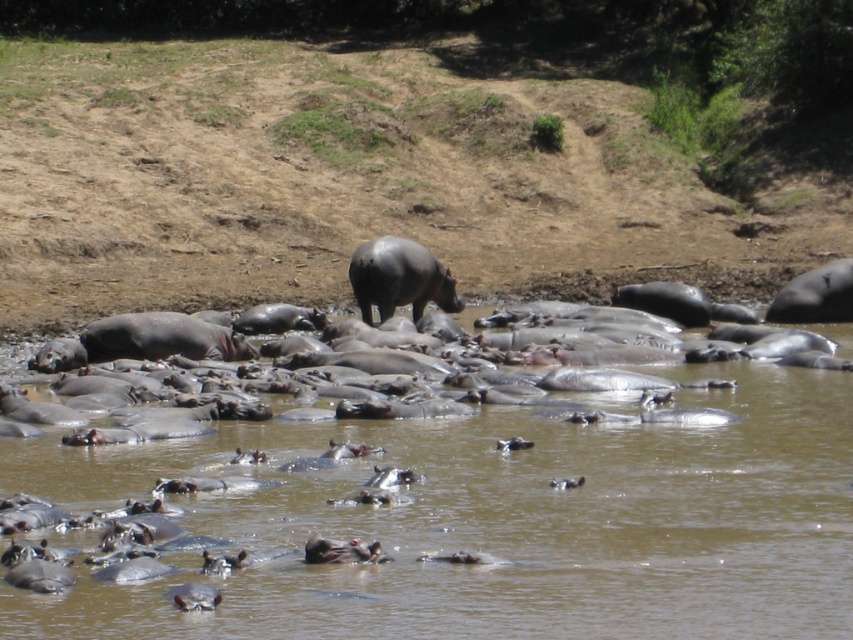
Is gray matte hippo at center to the right of gray matte hippo at right from the viewer's perspective?

No, gray matte hippo at center is not to the right of gray matte hippo at right.

Which is above, gray matte hippo at center or gray matte hippo at right?

gray matte hippo at center is above.

Locate an element on the screen. The width and height of the screenshot is (853, 640). gray matte hippo at center is located at coordinates (399, 278).

Between point (706, 636) and point (372, 262), which one is positioned behind?

Point (372, 262)

Does brown matte hippopotamus at center appear on the right side of gray matte hippo at center?

Yes, brown matte hippopotamus at center is to the right of gray matte hippo at center.

Find the location of a particular element. The width and height of the screenshot is (853, 640). brown matte hippopotamus at center is located at coordinates (502, 524).

Who is more forward, [758,388] or [785,316]?

Point [758,388]

Is brown matte hippopotamus at center above gray matte hippo at right?

Actually, brown matte hippopotamus at center is below gray matte hippo at right.

At what (x,y) coordinates should I click in order to perform the action: click on brown matte hippopotamus at center. Please return your answer as a coordinate pair (x, y). This screenshot has width=853, height=640. Looking at the image, I should click on (502, 524).